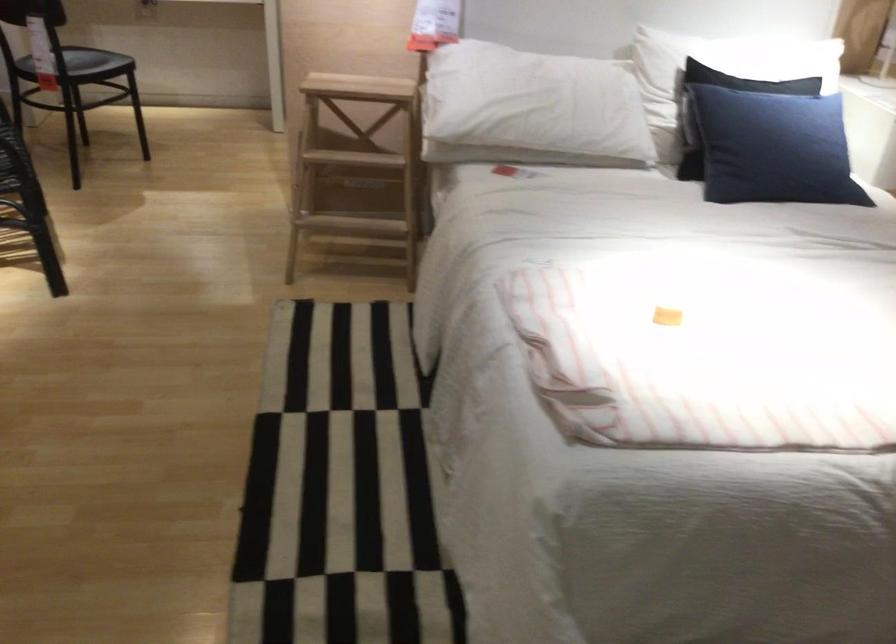
Find where to sit the black chair sitting surface. Please return your answer as a coordinate pair (x, y).

(82, 57)